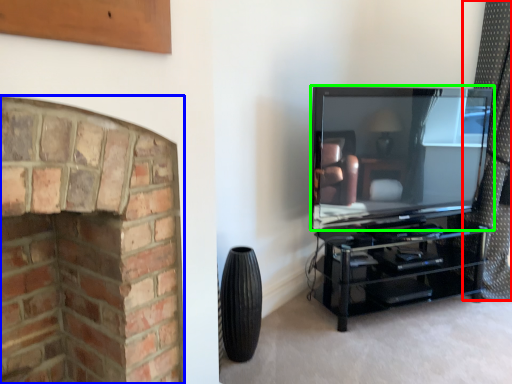
Question: Estimate the real-world distances between objects in this image. Which object is closer to curtain (highlighted by a red box), fireplace (highlighted by a blue box) or television (highlighted by a green box)?

Choices:
 (A) fireplace
 (B) television

Answer: (B)